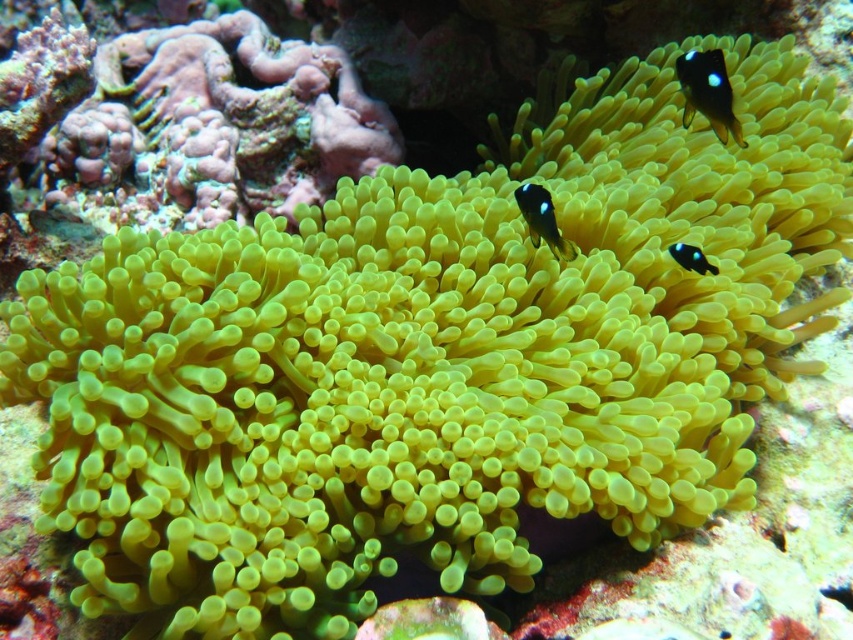
You are an underwater photographer aiming to capture the black glossy fish at upper right and the black glossy fish at center in a single frame. Which fish should you focus on first to ensure both are in the frame without moving your camera?

You should focus on the black glossy fish at center first because it is shorter than the black glossy fish at upper right, so by centering your focus on the shorter fish, you can ensure both are within the frame without needing to adjust your camera position.

You are a marine biologist studying underwater life. You observe the black glossy fish at center in the image. What are the coordinates of its position?

The coordinates of the black glossy fish at center are at point (543, 220).

You are a marine biologist observing this underwater scene from a submarine window. The black glossy fish at center is part of your study. If your submarine window is 5 feet away from the coral formation, can you confirm if the fish is within the 5 feet range from the window?

The black glossy fish at center is 6.00 feet away from the viewer, which is beyond the 5 feet range of the submarine window. Therefore, the fish is outside the immediate 5 feet proximity of the window.